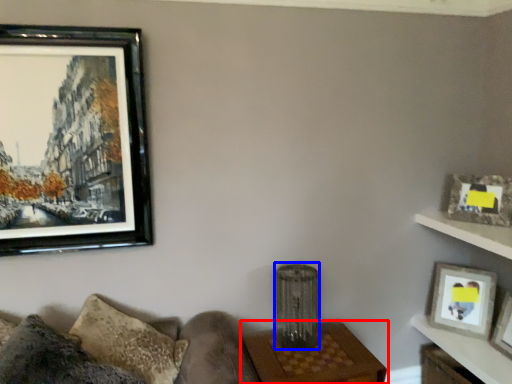
Question: Among these objects, which one is nearest to the camera, table (highlighted by a red box) or lamp (highlighted by a blue box)?

Choices:
 (A) table
 (B) lamp

Answer: (A)